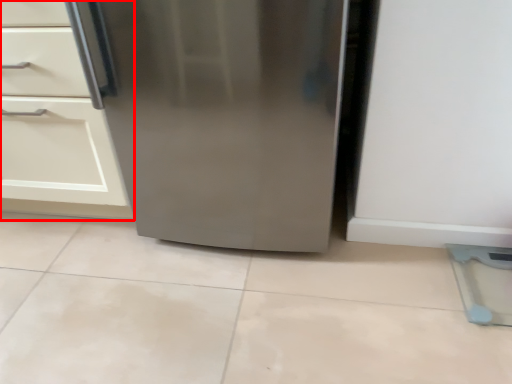
Question: Considering the relative positions of cabinetry (annotated by the red box) and refrigerator in the image provided, where is cabinetry (annotated by the red box) located with respect to the staircase?

Choices:
 (A) right
 (B) left

Answer: (B)